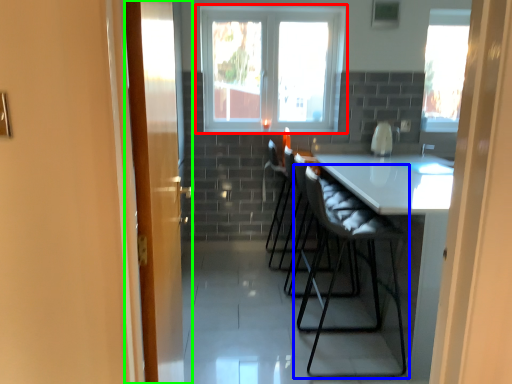
Question: Considering the real-world distances, which object is farthest from window (highlighted by a red box)? chair (highlighted by a blue box) or door (highlighted by a green box)?

Choices:
 (A) chair
 (B) door

Answer: (B)